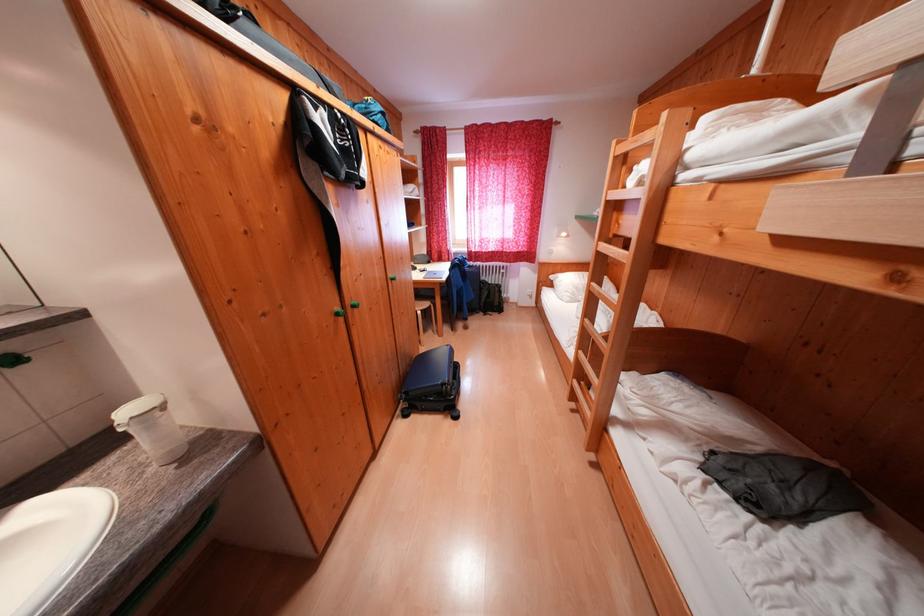
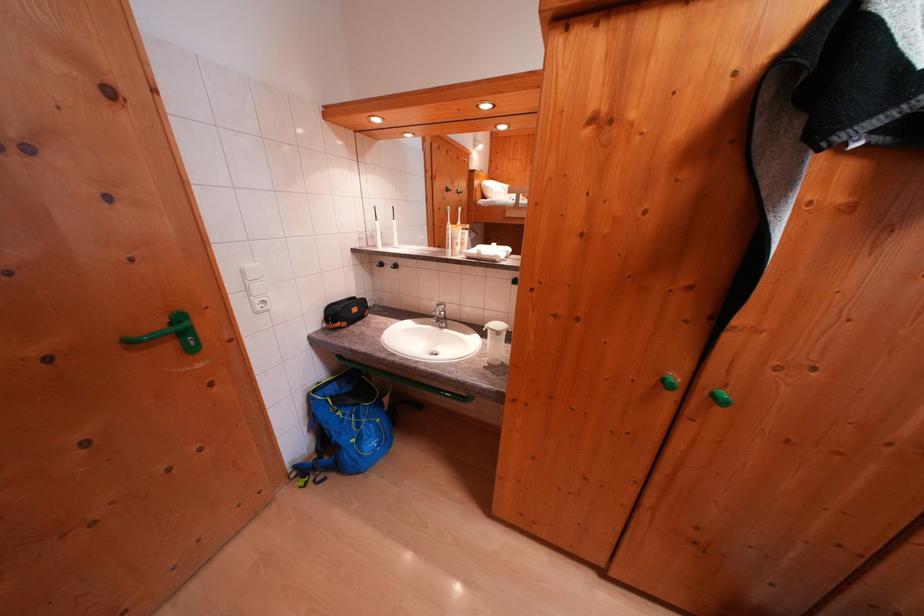
First-person continuous shooting, in which direction is the camera rotating?

The camera rotated toward left-down.